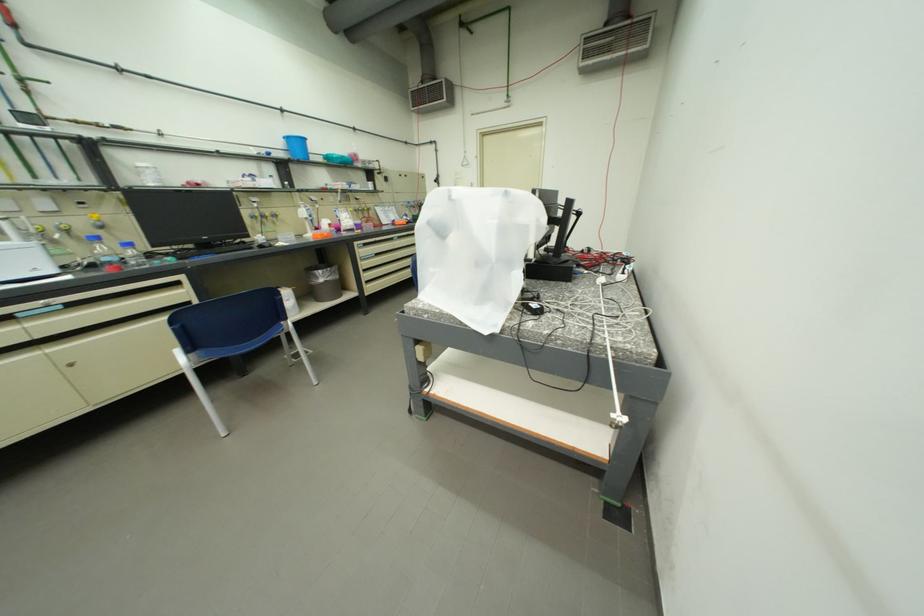
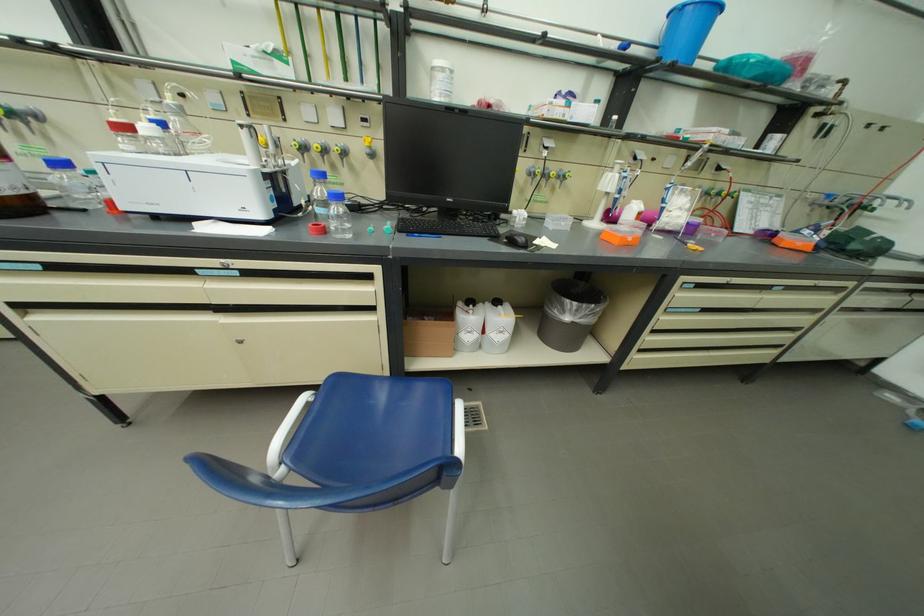
The point at [294,140] is marked in the first image. Where is the corresponding point in the second image?

(677, 20)